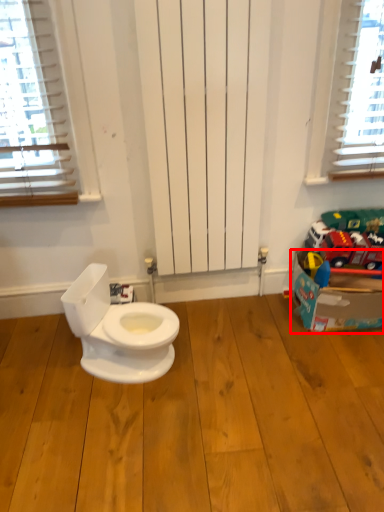
Question: From the image's perspective, where is cardboard box (annotated by the red box) located in relation to hardwood in the image?

Choices:
 (A) above
 (B) below

Answer: (A)